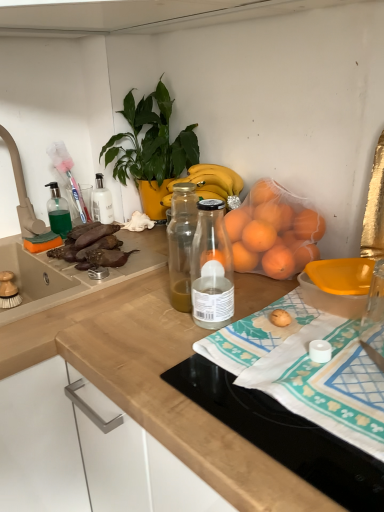
Question: From the image's perspective, is brown matte eggplant at left beneath wooden at center, the first countertop when ordered from left to right?

Choices:
 (A) yes
 (B) no

Answer: (B)

Question: From the image's perspective, does brown matte eggplant at left appear higher than wooden at center, which is the second countertop in right-to-left order?

Choices:
 (A) yes
 (B) no

Answer: (A)

Question: Can you confirm if brown matte eggplant at left is bigger than wooden at center, the first countertop when ordered from left to right?

Choices:
 (A) yes
 (B) no

Answer: (B)

Question: Is brown matte eggplant at left wider than wooden at center, which is the second countertop in right-to-left order?

Choices:
 (A) yes
 (B) no

Answer: (B)

Question: Is the depth of brown matte eggplant at left greater than that of wooden at center, which is the second countertop in right-to-left order?

Choices:
 (A) yes
 (B) no

Answer: (A)

Question: Is green translucent soap dispenser at left inside the boundaries of brown matte eggplant at left, or outside?

Choices:
 (A) outside
 (B) inside

Answer: (A)

Question: Is point (61, 216) closer or farther from the camera than point (114, 256)?

Choices:
 (A) closer
 (B) farther

Answer: (B)

Question: From the image's perspective, is green translucent soap dispenser at left positioned above or below brown matte eggplant at left?

Choices:
 (A) above
 (B) below

Answer: (A)

Question: From a real-world perspective, is green translucent soap dispenser at left physically located above or below brown matte eggplant at left?

Choices:
 (A) above
 (B) below

Answer: (A)

Question: Relative to brown matte eggplant at left, is yellow plastic bowl at lower right in front or behind?

Choices:
 (A) behind
 (B) front

Answer: (B)

Question: Considering the positions of point (359, 278) and point (76, 243), is point (359, 278) closer or farther from the camera than point (76, 243)?

Choices:
 (A) closer
 (B) farther

Answer: (A)

Question: Considering the positions of yellow plastic bowl at lower right and brown matte eggplant at left in the image, is yellow plastic bowl at lower right wider or thinner than brown matte eggplant at left?

Choices:
 (A) thin
 (B) wide

Answer: (A)

Question: Considering the positions of yellow plastic bowl at lower right and brown matte eggplant at left in the image, is yellow plastic bowl at lower right bigger or smaller than brown matte eggplant at left?

Choices:
 (A) big
 (B) small

Answer: (B)

Question: Based on their sizes in the image, would you say green plastic faucet at upper left is bigger or smaller than wooden at upper right, positioned as the second countertop in left-to-right order?

Choices:
 (A) big
 (B) small

Answer: (B)

Question: Considering the positions of green plastic faucet at upper left and wooden at upper right, positioned as the second countertop in left-to-right order, in the image, is green plastic faucet at upper left wider or thinner than wooden at upper right, positioned as the second countertop in left-to-right order,?

Choices:
 (A) thin
 (B) wide

Answer: (A)